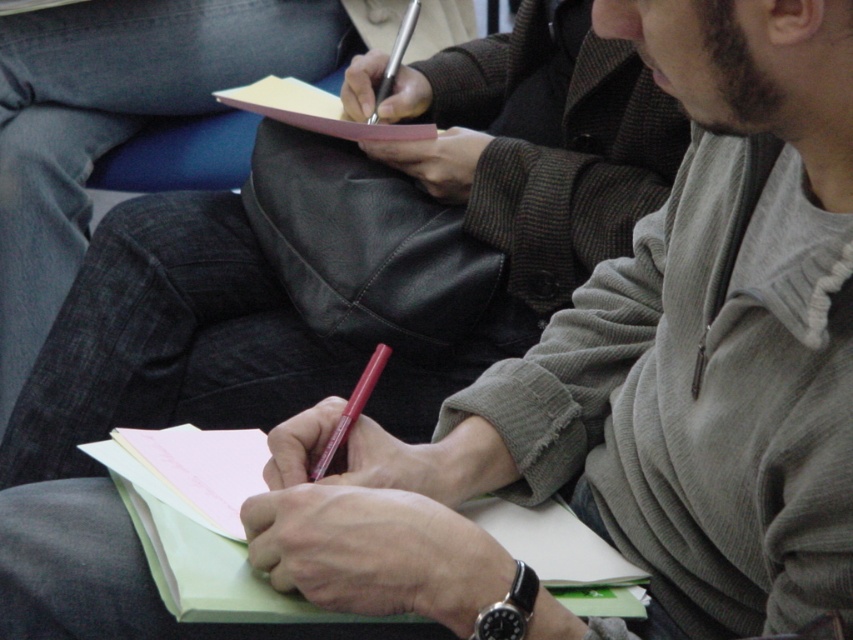
Who is lower down, matte pink pencil at center or metallic silver pen at upper center?

Positioned lower is matte pink pencil at center.

Describe the element at coordinates (351, 410) in the screenshot. This screenshot has width=853, height=640. I see `matte pink pencil at center` at that location.

Between point (328, 448) and point (386, 67), which one is positioned in front?

Positioned in front is point (328, 448).

Locate an element on the screen. The image size is (853, 640). matte pink pencil at center is located at coordinates (351, 410).

Which is below, pink paper at center or matte pink pencil at center?

matte pink pencil at center is lower down.

Between point (325, 132) and point (381, 371), which one is positioned behind?

The point (325, 132) is behind.

Between point (383, 131) and point (378, 348), which one is positioned behind?

The point (383, 131) is behind.

The image size is (853, 640). Find the location of `pink paper at center`. pink paper at center is located at coordinates (314, 109).

Does pink paper at center appear on the left side of metallic silver pen at upper center?

Indeed, pink paper at center is positioned on the left side of metallic silver pen at upper center.

Where is `pink paper at center`? pink paper at center is located at coordinates (314, 109).